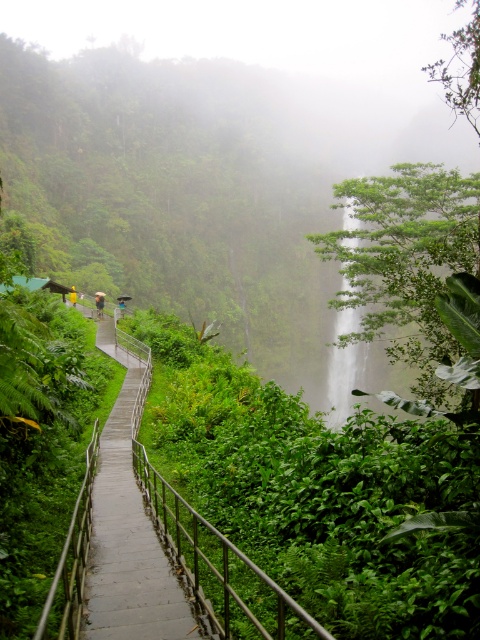
Is metallic silver rail at left to the left of green leafy waterfall at center from the viewer's perspective?

Correct, you'll find metallic silver rail at left to the left of green leafy waterfall at center.

Is metallic silver rail at left wider than green leafy waterfall at center?

Incorrect, metallic silver rail at left's width does not surpass green leafy waterfall at center's.

What do you see at coordinates (220, 568) in the screenshot? The height and width of the screenshot is (640, 480). I see `metallic silver rail at left` at bounding box center [220, 568].

At what (x,y) coordinates should I click in order to perform the action: click on metallic silver rail at left. Please return your answer as a coordinate pair (x, y). Image resolution: width=480 pixels, height=640 pixels. Looking at the image, I should click on (220, 568).